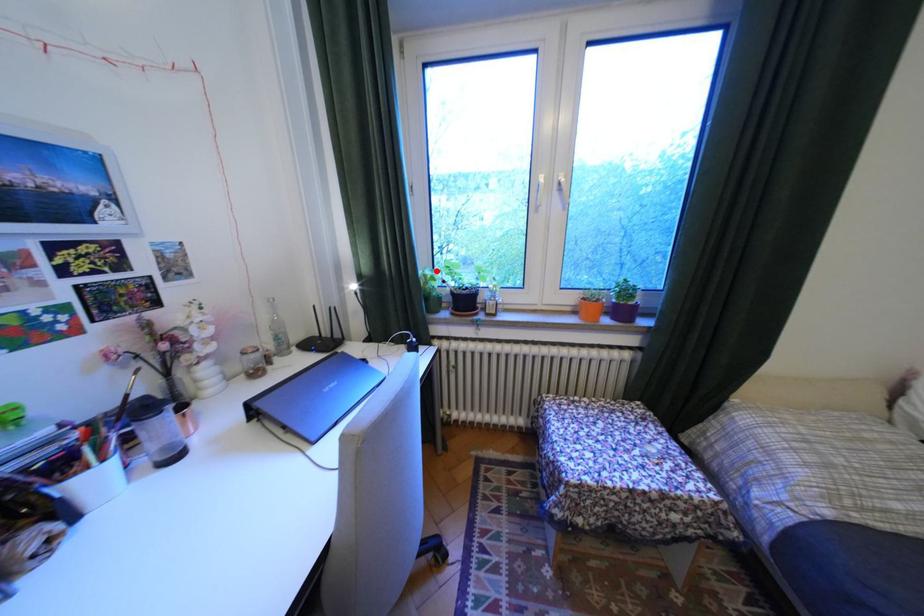
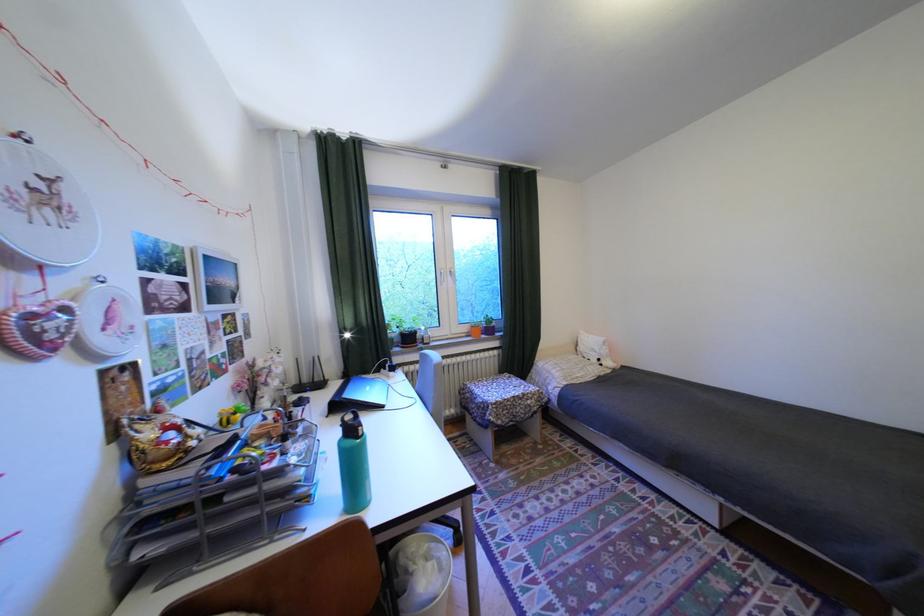
The point at the highlighted location is marked in the first image. Where is the corresponding point in the second image?

(397, 322)